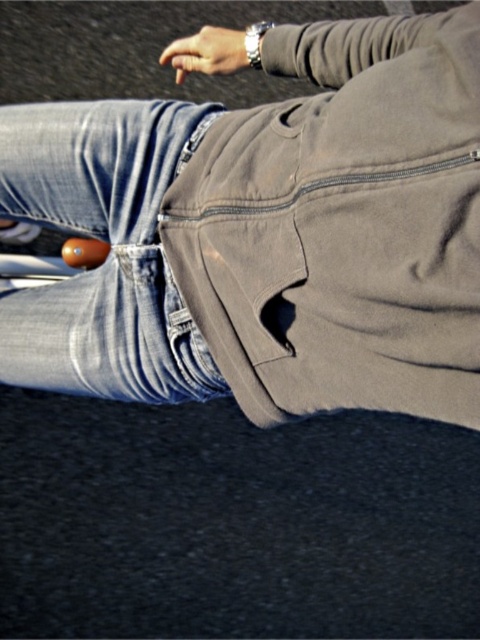
You are a photographer trying to capture a candid shot of the person in the scene. You need to position yourself so that the matte khaki pants at center are in focus while keeping the background blurred. Given the camera lens you have can only maintain focus on objects within a 25 inch range, will you be able to achieve this effect?

The objects are 27.78 inches apart, which exceeds the camera lens focus range of 25 inches. Therefore, it will be difficult to keep the matte khaki pants at center in focus while blurring the background with the current lens settings.

You are a photographer trying to capture a candid shot of the person in the scene. Since you want to focus on their clothing, you need to ensure both the matte khaki pants at center and the denim at center are visible. Given their sizes, which clothing item will take up more space in your photo?

The matte khaki pants at center is larger in size than the denim at center, so it will take up more space in the photo.